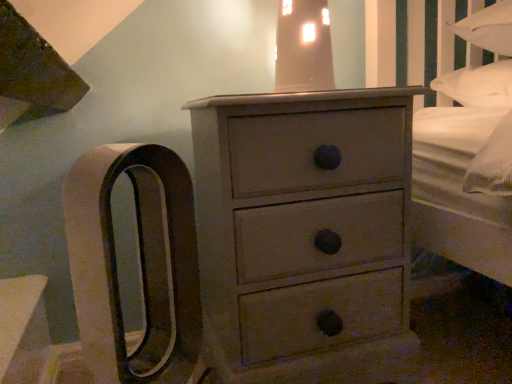
Question: From the image's perspective, is matte gray chest of drawers at center located above or below matte glass lampshade at upper center?

Choices:
 (A) above
 (B) below

Answer: (B)

Question: Considering their positions, is matte gray chest of drawers at center located in front of or behind matte glass lampshade at upper center?

Choices:
 (A) front
 (B) behind

Answer: (A)

Question: Is matte gray chest of drawers at center spatially inside matte glass lampshade at upper center, or outside of it?

Choices:
 (A) inside
 (B) outside

Answer: (B)

Question: Choose the correct answer: Is matte glass lampshade at upper center inside matte gray chest of drawers at center or outside it?

Choices:
 (A) outside
 (B) inside

Answer: (A)

Question: From a real-world perspective, is matte glass lampshade at upper center above or below matte gray chest of drawers at center?

Choices:
 (A) above
 (B) below

Answer: (A)

Question: From their relative heights in the image, would you say matte glass lampshade at upper center is taller or shorter than matte gray chest of drawers at center?

Choices:
 (A) tall
 (B) short

Answer: (B)

Question: In the image, is matte glass lampshade at upper center on the left side or the right side of matte gray chest of drawers at center?

Choices:
 (A) left
 (B) right

Answer: (B)